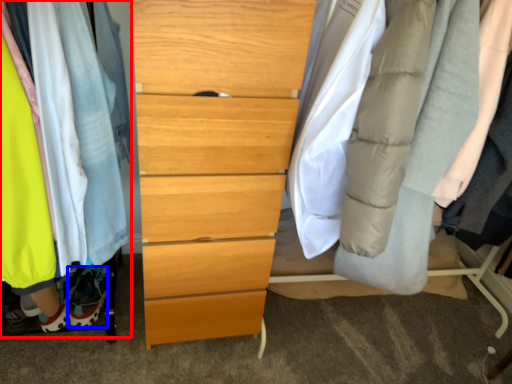
Question: Which object appears closest to the camera in this image, closet (highlighted by a red box) or shoe (highlighted by a blue box)?

Choices:
 (A) closet
 (B) shoe

Answer: (A)